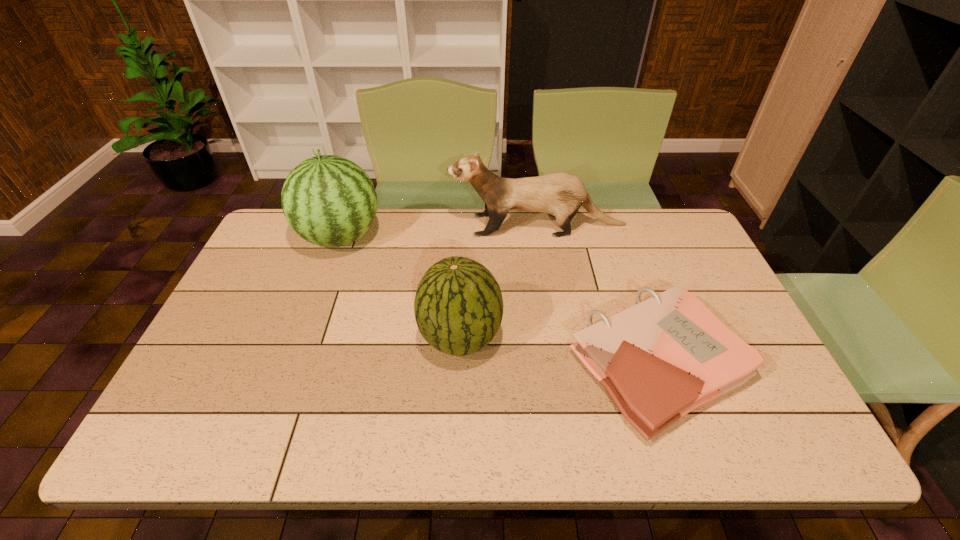
Locate an element on the screen. The height and width of the screenshot is (540, 960). vacant region between the right watermelon and the farther watermelon is located at coordinates (400, 288).

Identify which object is the third closest to the phonebook. Please provide its 2D coordinates. Your answer should be formatted as a tuple, i.e. [(x, y)], where the tuple contains the x and y coordinates of a point satisfying the conditions above.

[(328, 200)]

The width and height of the screenshot is (960, 540). In order to click on object that is the second nearest to the ferret in this screenshot , I will do `click(660, 359)`.

Where is `vacant space that satisfies the following two spatial constraints: 1. on the face of the phonebook; 2. on the right side of the ferret`? Image resolution: width=960 pixels, height=540 pixels. vacant space that satisfies the following two spatial constraints: 1. on the face of the phonebook; 2. on the right side of the ferret is located at coordinates (559, 365).

Image resolution: width=960 pixels, height=540 pixels. I want to click on vacant space that satisfies the following two spatial constraints: 1. on the front side of the shortest object; 2. on the right side of the left watermelon, so click(x=295, y=365).

You are a GUI agent. You are given a task and a screenshot of the screen. Output one action in this format:
    pyautogui.click(x=<x>, y=<y>)
    Task: Click on the vacant space that satisfies the following two spatial constraints: 1. on the front side of the shorter watermelon; 2. on the right side of the phonebook
    Image resolution: width=960 pixels, height=540 pixels.
    Given the screenshot: What is the action you would take?
    pyautogui.click(x=460, y=365)

The height and width of the screenshot is (540, 960). In order to click on free location that satisfies the following two spatial constraints: 1. on the face of the ferret; 2. on the right side of the shortest object in this screenshot , I will do `click(559, 365)`.